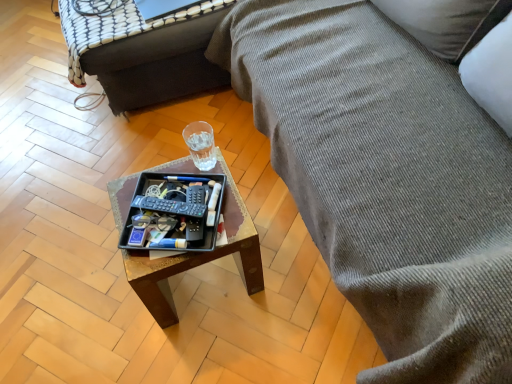
Question: Is clear glass cup at center spatially inside textured gray fabric couch at right, or outside of it?

Choices:
 (A) outside
 (B) inside

Answer: (A)

Question: From the image's perspective, is clear glass cup at center above or below textured gray fabric couch at right?

Choices:
 (A) above
 (B) below

Answer: (B)

Question: Estimate the real-world distances between objects in this image. Which object is closer to the wooden tray at center?

Choices:
 (A) clear glass cup at center
 (B) wooden tray at center
 (C) textured gray fabric couch at right
 (D) black plastic tray at center

Answer: (C)

Question: Based on their relative distances, which object is farther from the textured gray fabric couch at right?

Choices:
 (A) black plastic tray at center
 (B) wooden tray at center
 (C) wooden tray at center
 (D) clear glass cup at center

Answer: (C)